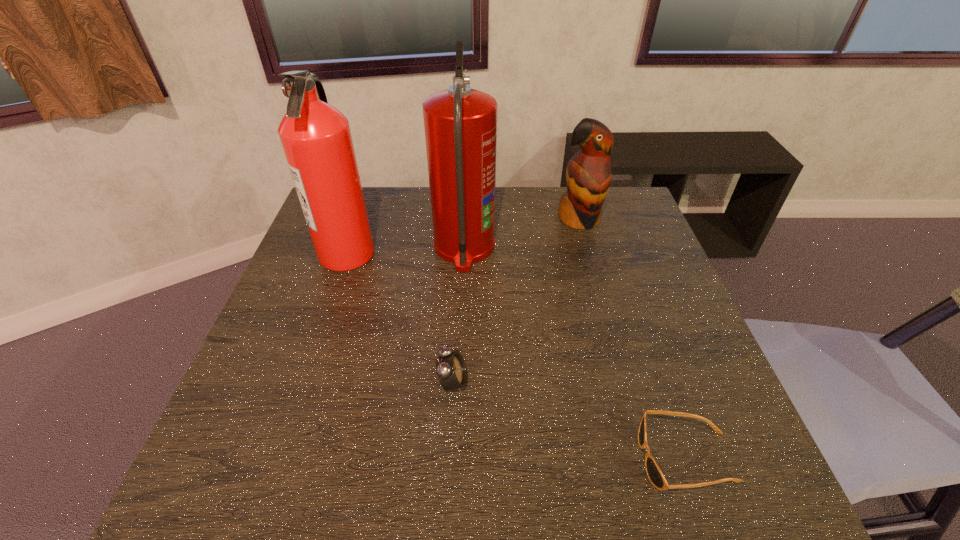
Locate an element on the screen. vacant position located on the face of the second shortest object is located at coordinates (639, 382).

In order to click on free region located on the front-facing side of the nearest object in this screenshot , I will do `click(455, 458)`.

Identify the location of free location located on the front-facing side of the nearest object. This screenshot has height=540, width=960. (427, 458).

The height and width of the screenshot is (540, 960). Identify the location of vacant region located 0.280m on the front-facing side of the nearest object. (488, 458).

Find the location of `parrot present at the far edge`. parrot present at the far edge is located at coordinates (588, 175).

This screenshot has height=540, width=960. In order to click on object that is at the near edge in this screenshot , I will do coord(653,471).

You are a GUI agent. You are given a task and a screenshot of the screen. Output one action in this format:
    pyautogui.click(x=<x>, y=<y>)
    Task: Click on the object that is positioned at the left edge
    The width and height of the screenshot is (960, 540).
    Given the screenshot: What is the action you would take?
    pyautogui.click(x=316, y=138)

Identify the location of parrot at the right edge. The image size is (960, 540). (588, 175).

This screenshot has height=540, width=960. I want to click on sunglasses present at the right edge, so click(653, 471).

Find the location of a particular element. object that is at the far left corner is located at coordinates (316, 138).